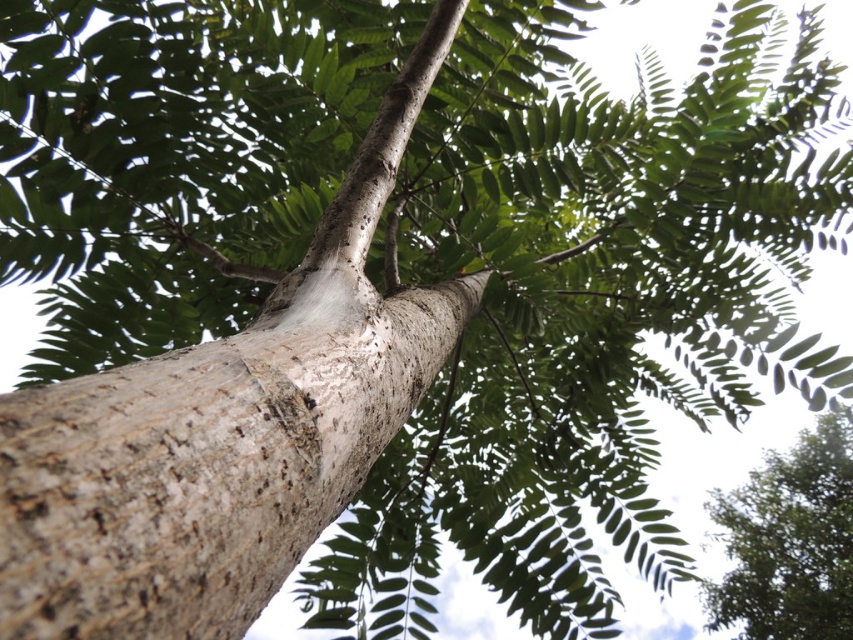
Is smooth bark tree trunk at center bigger than green rough bark tree at upper right?

No.

Is smooth bark tree trunk at center thinner than green rough bark tree at upper right?

Correct, smooth bark tree trunk at center's width is less than green rough bark tree at upper right's.

Identify the location of smooth bark tree trunk at center. (207, 461).